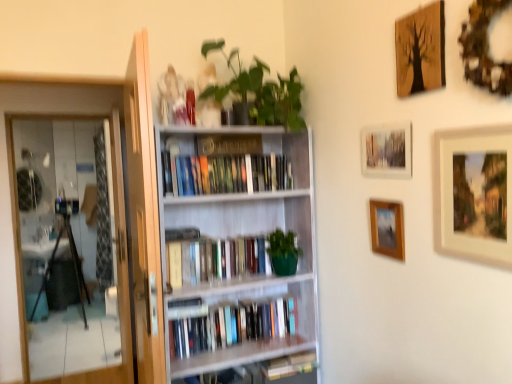
Where is `matte black paperback book at center`? This screenshot has height=384, width=512. matte black paperback book at center is located at coordinates (229, 144).

This screenshot has width=512, height=384. Describe the element at coordinates (420, 50) in the screenshot. I see `wooden textured picture frame at upper right, arranged as the first picture frame when viewed from the top` at that location.

The width and height of the screenshot is (512, 384). I want to click on hardcover books at center, the third book positioned from the top, so click(232, 326).

I want to click on green matte plant at upper center, so click(x=258, y=92).

This screenshot has width=512, height=384. Describe the element at coordinates (387, 228) in the screenshot. I see `wooden picture frame at center-right, positioned as the fourth picture frame in top-to-bottom order` at that location.

Find the location of a particular element. The image size is (512, 384). matte black paperback book at center is located at coordinates (229, 144).

Considering the positions of point (62, 360) and point (278, 322), is point (62, 360) closer or farther from the camera than point (278, 322)?

Point (62, 360) is positioned farther from the camera compared to point (278, 322).

Between transparent glass screen door at left and hardcover books at center, the first book ordered from the bottom, which one has larger width?

hardcover books at center, the first book ordered from the bottom.

Could you measure the distance between transparent glass screen door at left and hardcover books at center, the first book ordered from the bottom?

A distance of 6.08 feet exists between transparent glass screen door at left and hardcover books at center, the first book ordered from the bottom.

From the image's perspective, who appears lower, white wooden bookcase at center or wooden framed photo at upper center, marked as the 3th picture frame in a bottom-to-top arrangement?

white wooden bookcase at center appears lower in the image.

From a real-world perspective, between white wooden bookcase at center and wooden framed photo at upper center, marked as the 3th picture frame in a bottom-to-top arrangement, who is vertically lower?

In real-world perspective, white wooden bookcase at center is lower.

Between white wooden bookcase at center and wooden framed photo at upper center, which is the 2th picture frame in top-to-bottom order, which one has smaller size?

wooden framed photo at upper center, which is the 2th picture frame in top-to-bottom order, is smaller.

Could you tell me if green matte bookshelf at center, the second book positioned from the bottom, is facing wooden framed painting at upper right, which is counted as the second picture frame, starting from the bottom?

No, green matte bookshelf at center, the second book positioned from the bottom, is not turned towards wooden framed painting at upper right, which is counted as the second picture frame, starting from the bottom.

Can you confirm if green matte bookshelf at center, the second book positioned from the bottom, is bigger than wooden framed painting at upper right, which is counted as the second picture frame, starting from the bottom?

Yes, green matte bookshelf at center, the second book positioned from the bottom, is bigger than wooden framed painting at upper right, which is counted as the second picture frame, starting from the bottom.

Considering the positions of objects green matte bookshelf at center, the second book positioned from the bottom, and wooden framed painting at upper right, which is counted as the second picture frame, starting from the bottom, in the image provided, who is behind, green matte bookshelf at center, the second book positioned from the bottom, or wooden framed painting at upper right, which is counted as the second picture frame, starting from the bottom,?

green matte bookshelf at center, the second book positioned from the bottom, is further away from the camera.

From a real-world perspective, is green matte bookshelf at center, the second book positioned from the bottom, beneath wooden framed painting at upper right, which is counted as the second picture frame, starting from the bottom?

Yes, from a real-world perspective, green matte bookshelf at center, the second book positioned from the bottom, is below wooden framed painting at upper right, which is counted as the second picture frame, starting from the bottom.

Is point (262, 86) closer or farther from the camera than point (62, 244)?

Point (262, 86).

From the image's perspective, which is below, green matte plant at upper center or transparent glass screen door at left?

transparent glass screen door at left is shown below in the image.

Visually, is green matte plant at upper center positioned to the left or to the right of transparent glass screen door at left?

Clearly, green matte plant at upper center is on the right of transparent glass screen door at left in the image.

Which is more to the left, hardcover books at center, which is the first book in top-to-bottom order, or wooden picture frame at center-right, positioned as the fourth picture frame in top-to-bottom order?

From the viewer's perspective, hardcover books at center, which is the first book in top-to-bottom order, appears more on the left side.

This screenshot has width=512, height=384. I want to click on the 1st picture frame in front of the hardcover books at center, which is the 3th book from bottom to top, so click(x=387, y=228).

Considering the positions of objects hardcover books at center, which is the first book in top-to-bottom order, and wooden picture frame at center-right, positioned as the fourth picture frame in top-to-bottom order, in the image provided, who is behind, hardcover books at center, which is the first book in top-to-bottom order, or wooden picture frame at center-right, positioned as the fourth picture frame in top-to-bottom order,?

hardcover books at center, which is the first book in top-to-bottom order, is further from the camera.

Is hardcover books at center, which is the 3th book from bottom to top, positioned beyond the bounds of wooden picture frame at center-right, positioned as the fourth picture frame in top-to-bottom order?

That's correct, hardcover books at center, which is the 3th book from bottom to top, is outside of wooden picture frame at center-right, positioned as the fourth picture frame in top-to-bottom order.

Consider the image. Can you confirm if matte black paperback book at center is wider than wooden picture frame at center-right, the first picture frame ordered from the bottom?

Correct, the width of matte black paperback book at center exceeds that of wooden picture frame at center-right, the first picture frame ordered from the bottom.

Where is `paperback book that appears on the left of wooden picture frame at center-right, the first picture frame ordered from the bottom`? paperback book that appears on the left of wooden picture frame at center-right, the first picture frame ordered from the bottom is located at coordinates (229, 144).

Is matte black paperback book at center bigger or smaller than wooden picture frame at center-right, the first picture frame ordered from the bottom?

In the image, matte black paperback book at center appears to be larger than wooden picture frame at center-right, the first picture frame ordered from the bottom.

From the picture: Between hardcover books at center, which is the 3th book from bottom to top, and white wooden bookcase at center, which one appears on the right side from the viewer's perspective?

Positioned to the right is white wooden bookcase at center.

Locate an element on the screen. This screenshot has width=512, height=384. the 2nd book positioned above the white wooden bookcase at center (from the image's perspective) is located at coordinates (226, 170).

Which is in front, point (249, 144) or point (256, 193)?

The point (249, 144) is more forward.

Where is `screen door that is above the hardcover books at center, the first book ordered from the bottom (from the image's perspective)`? screen door that is above the hardcover books at center, the first book ordered from the bottom (from the image's perspective) is located at coordinates (55, 244).

Where is `the 2nd picture frame in front of the white wooden bookcase at center, counting from the anchor's position`? the 2nd picture frame in front of the white wooden bookcase at center, counting from the anchor's position is located at coordinates (387, 151).

Which object lies further to the anchor point hardcover books at center, which is the 3th book from bottom to top, white wooden bookcase at center or matte black paperback book at center?

white wooden bookcase at center lies further to hardcover books at center, which is the 3th book from bottom to top, than the other object.

Based on their spatial positions, is hardcover books at center, the third book positioned from the top, or transparent glass screen door at left further from wooden framed photo at upper center, which is the 2th picture frame in top-to-bottom order?

transparent glass screen door at left.

From the image, which object appears to be nearer to wooden framed painting at upper right, which is counted as the 3th picture frame, starting from the top, wooden picture frame at center-right, positioned as the fourth picture frame in top-to-bottom order, or white wooden bookcase at center?

wooden picture frame at center-right, positioned as the fourth picture frame in top-to-bottom order, is positioned closer to the anchor wooden framed painting at upper right, which is counted as the 3th picture frame, starting from the top.

From the image, which object appears to be farther from wooden framed photo at upper center, marked as the 3th picture frame in a bottom-to-top arrangement, wooden textured picture frame at upper right, arranged as the first picture frame when viewed from the top, or hardcover books at center, the third book positioned from the top?

hardcover books at center, the third book positioned from the top, lies further to wooden framed photo at upper center, marked as the 3th picture frame in a bottom-to-top arrangement, than the other object.

Estimate the real-world distances between objects in this image. Which object is closer to hardcover books at center, which is the 3th book from bottom to top, white wooden bookcase at center or transparent glass screen door at left?

Based on the image, white wooden bookcase at center appears to be nearer to hardcover books at center, which is the 3th book from bottom to top.

Based on their spatial positions, is hardcover books at center, which is the first book in top-to-bottom order, or green matte plant at upper center closer to green matte bookshelf at center, which is counted as the second book, starting from the top?

The object closer to green matte bookshelf at center, which is counted as the second book, starting from the top, is hardcover books at center, which is the first book in top-to-bottom order.

Considering their positions, is hardcover books at center, which is the 3th book from bottom to top, positioned closer to white wooden bookcase at center than wooden picture frame at center-right, the first picture frame ordered from the bottom?

hardcover books at center, which is the 3th book from bottom to top, is closer to white wooden bookcase at center.

Based on the photo, looking at the image, which one is located closer to wooden picture frame at center-right, the first picture frame ordered from the bottom, wooden textured picture frame at upper right, positioned as the 4th picture frame in bottom-to-top order, or white wooden bookcase at center?

wooden textured picture frame at upper right, positioned as the 4th picture frame in bottom-to-top order, is closer to wooden picture frame at center-right, the first picture frame ordered from the bottom.

The height and width of the screenshot is (384, 512). I want to click on bookcase between wooden framed photo at upper center, which is the 2th picture frame in top-to-bottom order, and hardcover books at center, the third book positioned from the top, vertically, so click(x=236, y=252).

The width and height of the screenshot is (512, 384). Find the location of `bookcase between wooden framed painting at upper right, which is counted as the second picture frame, starting from the bottom, and hardcover books at center, which is the first book in top-to-bottom order, in the front-back direction`. bookcase between wooden framed painting at upper right, which is counted as the second picture frame, starting from the bottom, and hardcover books at center, which is the first book in top-to-bottom order, in the front-back direction is located at coordinates (236, 252).

In order to click on bookcase situated between transparent glass screen door at left and wooden textured picture frame at upper right, arranged as the first picture frame when viewed from the top, from left to right in this screenshot , I will do point(236,252).

Where is `bookcase between hardcover books at center, which is the first book in top-to-bottom order, and hardcover books at center, the first book ordered from the bottom, from top to bottom`? bookcase between hardcover books at center, which is the first book in top-to-bottom order, and hardcover books at center, the first book ordered from the bottom, from top to bottom is located at coordinates (236, 252).